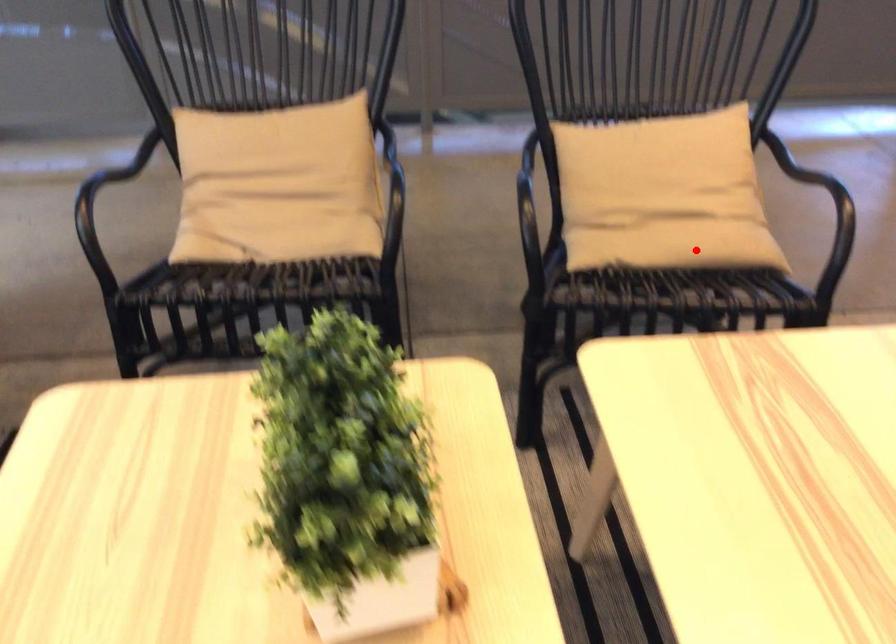
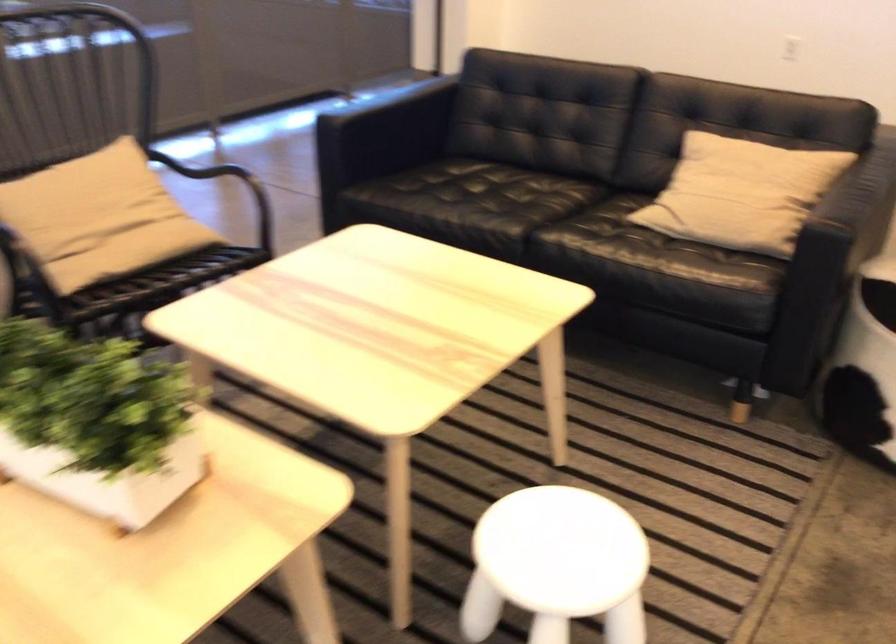
Question: I am providing you with two images of the same scene from different viewpoints. A red point is marked on the first image. At the location where the point appears in image 1, is it still visible in image 2?

Choices:
 (A) Yes
 (B) No

Answer: (A)